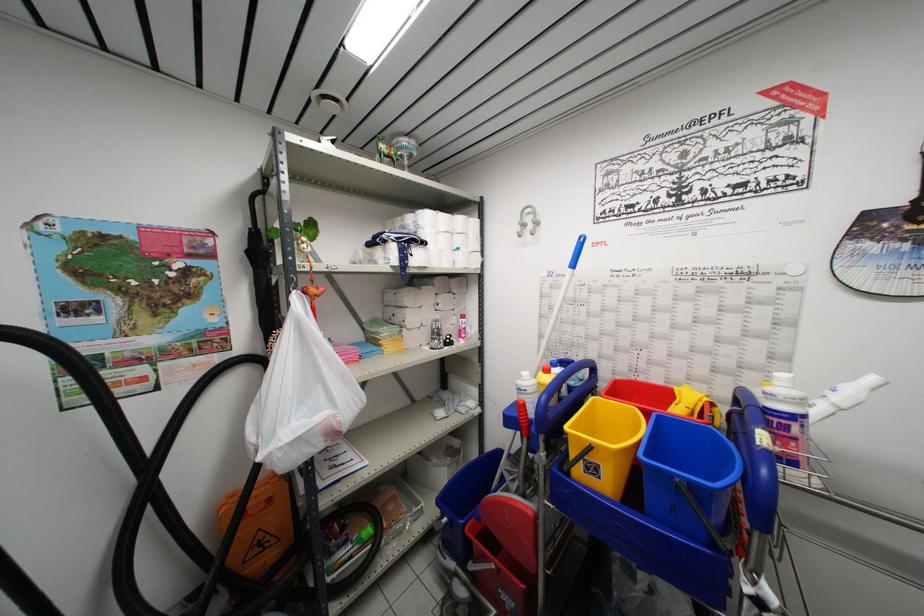
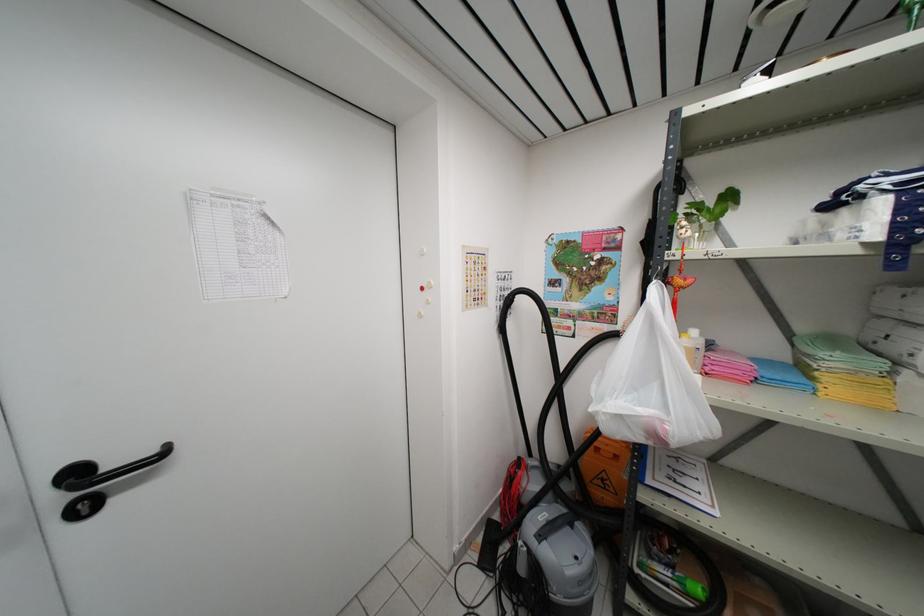
Question: I am providing you with two images of the same scene from different viewpoints. Please identify which objects are invisible in image2.

Choices:
 (A) black door handle
 (B) white circular magnet
 (C) yellow top bottle
 (D) none of these

Answer: (D)